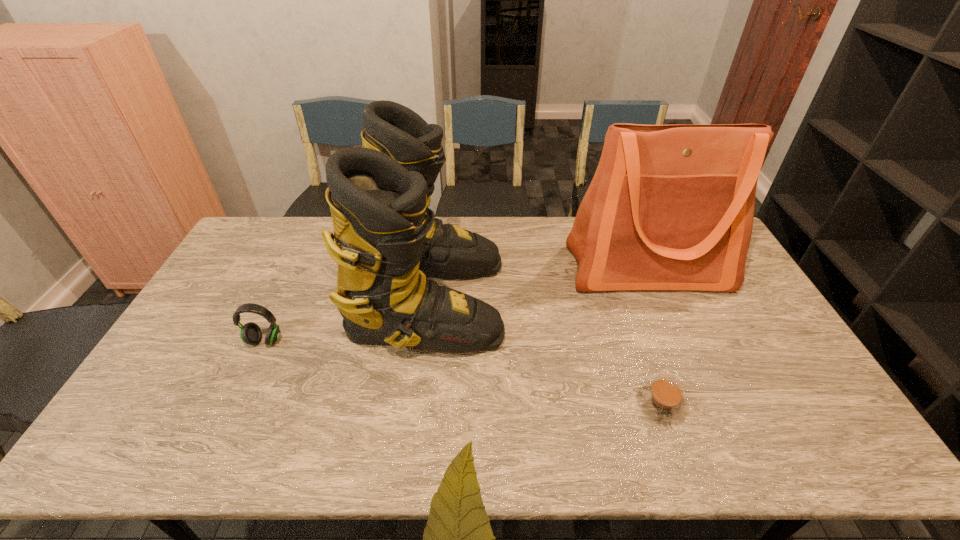
The width and height of the screenshot is (960, 540). Find the location of `ski boots that is at the far edge`. ski boots that is at the far edge is located at coordinates (387, 240).

You are a GUI agent. You are given a task and a screenshot of the screen. Output one action in this format:
    pyautogui.click(x=<x>, y=<y>)
    Task: Click on the shopping bag that is positioned at the far edge
    This screenshot has height=540, width=960.
    Given the screenshot: What is the action you would take?
    pyautogui.click(x=670, y=207)

Find the location of a particular element. object positioned at the near edge is located at coordinates (663, 400).

Locate an element on the screen. object present at the right edge is located at coordinates point(670,207).

This screenshot has height=540, width=960. I want to click on object that is positioned at the far right corner, so click(x=670, y=207).

The image size is (960, 540). I want to click on free space at the far edge, so tap(295, 227).

The width and height of the screenshot is (960, 540). In order to click on vacant space at the near edge in this screenshot , I will do `click(490, 462)`.

The image size is (960, 540). In the image, there is a desktop. Find the location of `free space at the right edge`. free space at the right edge is located at coordinates (775, 389).

Locate an element on the screen. The image size is (960, 540). free point between the shopping bag and the ski boots is located at coordinates (538, 285).

Where is `free spot between the shopping bag and the nearest object`? free spot between the shopping bag and the nearest object is located at coordinates (654, 336).